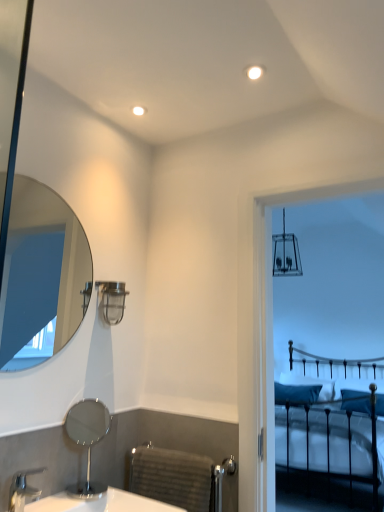
Question: Does clear glass mirror at upper left, arranged as the first mirror when viewed from the top, have a greater width compared to metallic industrial light fixture at upper center?

Choices:
 (A) no
 (B) yes

Answer: (A)

Question: From the image's perspective, would you say clear glass mirror at upper left, the 2th mirror when ordered from bottom to top, is positioned over metallic industrial light fixture at upper center?

Choices:
 (A) no
 (B) yes

Answer: (B)

Question: Is clear glass mirror at upper left, the 2th mirror when ordered from bottom to top, completely or partially outside of metallic industrial light fixture at upper center?

Choices:
 (A) no
 (B) yes

Answer: (B)

Question: Considering the relative sizes of clear glass mirror at upper left, the 2th mirror when ordered from bottom to top, and metallic industrial light fixture at upper center in the image provided, is clear glass mirror at upper left, the 2th mirror when ordered from bottom to top, shorter than metallic industrial light fixture at upper center?

Choices:
 (A) no
 (B) yes

Answer: (A)

Question: Considering the relative sizes of clear glass mirror at upper left, arranged as the first mirror when viewed from the top, and metallic industrial light fixture at upper center in the image provided, is clear glass mirror at upper left, arranged as the first mirror when viewed from the top, smaller than metallic industrial light fixture at upper center?

Choices:
 (A) no
 (B) yes

Answer: (A)

Question: Considering the relative positions of polished chrome mirror at lower left, placed as the 1th mirror when sorted from bottom to top, and blue fabric pillow at right, acting as the first pillow starting from the right, in the image provided, is polished chrome mirror at lower left, placed as the 1th mirror when sorted from bottom to top, to the left or to the right of blue fabric pillow at right, acting as the first pillow starting from the right,?

Choices:
 (A) left
 (B) right

Answer: (A)

Question: Considering the positions of polished chrome mirror at lower left, the second mirror viewed from the top, and blue fabric pillow at right, placed as the second pillow when sorted from left to right, in the image, is polished chrome mirror at lower left, the second mirror viewed from the top, taller or shorter than blue fabric pillow at right, placed as the second pillow when sorted from left to right,?

Choices:
 (A) tall
 (B) short

Answer: (A)

Question: Do you think polished chrome mirror at lower left, placed as the 1th mirror when sorted from bottom to top, is within blue fabric pillow at right, acting as the first pillow starting from the right, or outside of it?

Choices:
 (A) outside
 (B) inside

Answer: (A)

Question: Looking at the image, does polished chrome mirror at lower left, the second mirror viewed from the top, seem bigger or smaller compared to blue fabric pillow at right, placed as the second pillow when sorted from left to right?

Choices:
 (A) small
 (B) big

Answer: (A)

Question: Considering the positions of white glossy sink at lower left and silver metallic faucet at lower left in the image, is white glossy sink at lower left wider or thinner than silver metallic faucet at lower left?

Choices:
 (A) thin
 (B) wide

Answer: (B)

Question: Based on their sizes in the image, would you say white glossy sink at lower left is bigger or smaller than silver metallic faucet at lower left?

Choices:
 (A) big
 (B) small

Answer: (A)

Question: From the image's perspective, relative to silver metallic faucet at lower left, is white glossy sink at lower left above or below?

Choices:
 (A) above
 (B) below

Answer: (B)

Question: Is white glossy sink at lower left spatially inside silver metallic faucet at lower left, or outside of it?

Choices:
 (A) inside
 (B) outside

Answer: (B)

Question: Considering the relative positions of teal fabric pillow at center, the 2th pillow from the right, and blue fabric pillow at right, placed as the second pillow when sorted from left to right, in the image provided, is teal fabric pillow at center, the 2th pillow from the right, to the left or to the right of blue fabric pillow at right, placed as the second pillow when sorted from left to right,?

Choices:
 (A) left
 (B) right

Answer: (A)

Question: Is point (291, 391) closer or farther from the camera than point (362, 403)?

Choices:
 (A) farther
 (B) closer

Answer: (A)